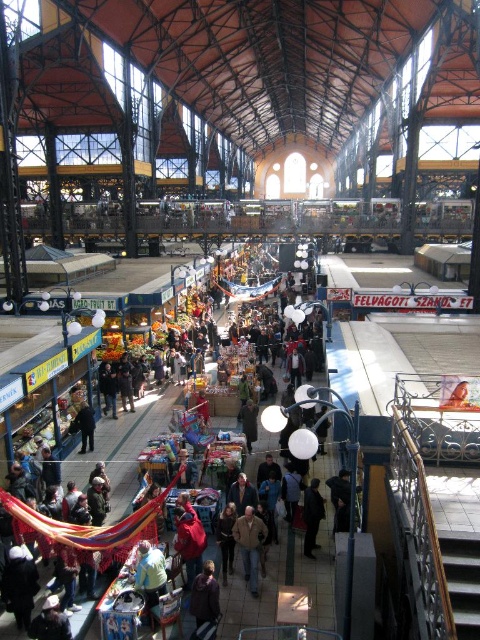
You are a customer in the market and see the brown leather jacket at center and the dark blue fabric at center. Which item is placed on top of the other?

The brown leather jacket at center is positioned over the dark blue fabric at center, so it is placed on top.

You are a customer in the market and want to buy both fabrics. The light blue fabric at center and the dark blue fabric at center are displayed on the same stall. Which fabric should you look to your left to find first?

The light blue fabric at center is to the left of dark blue fabric at center, so you should look to your left first to find the light blue fabric at center before the dark blue fabric at center.